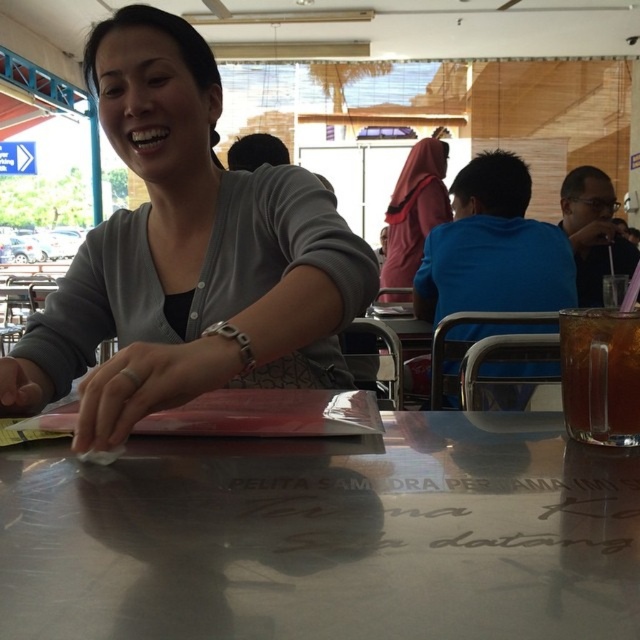
You are a server in a restaurant and you need to place the translucent glass cup at lower right on the table where the matte gray cardigan at center is located. Can you fit the cup on the table without moving the cardigan?

The matte gray cardigan at center is bigger than the translucent glass cup at lower right, so there might not be enough space left on the table to place the cup without moving the cardigan.

You are a server in a restaurant and need to deliver a tray of drinks to the table where the matte pink hijab at center is located. The tray is 2 feet wide. Can you safely carry the tray from the metallic silver table at center to the hijab location without needing to adjust your path?

The distance between the metallic silver table at center and the matte pink hijab at center is 7.68 feet. Since the tray is only 2 feet wide, there is sufficient space to carry it without needing to adjust your path.

You are standing in the dining area and want to reach both the point at coordinates point (324, 534) and the point at coordinates point (420, 236). Which point should you approach first to minimize the distance walked?

You should approach point (324, 534) first because it is closer to you than point (420, 236).